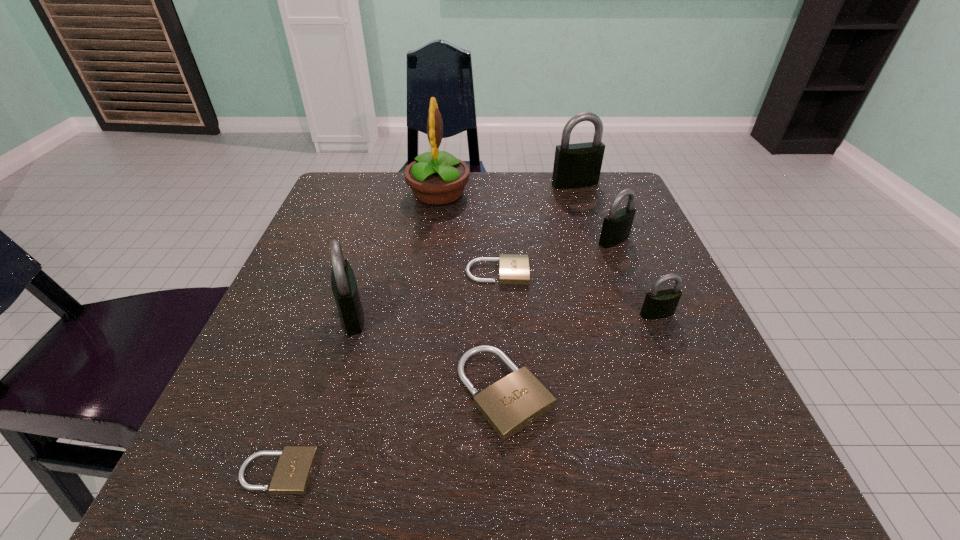
Identify the location of vacant area that lies between the farthest black padlock and the nearest object. The image size is (960, 540). (426, 328).

Find the location of a particular element. This screenshot has width=960, height=540. vacant region between the second nearest padlock and the biggest black padlock is located at coordinates (540, 288).

This screenshot has width=960, height=540. Find the location of `unoccupied position between the seventh farthest object and the third biggest black padlock`. unoccupied position between the seventh farthest object and the third biggest black padlock is located at coordinates (560, 316).

The image size is (960, 540). What are the coordinates of `empty space between the biggest black padlock and the tallest object` in the screenshot? It's located at (507, 189).

Identify which object is the fifth closest to the tallest padlock. Please provide its 2D coordinates. Your answer should be formatted as a tuple, i.e. [(x, y)], where the tuple contains the x and y coordinates of a point satisfying the conditions above.

[(509, 405)]

I want to click on the fourth closest object relative to the yellow sunflower, so click(616, 228).

The width and height of the screenshot is (960, 540). I want to click on the second closest padlock to the second smallest black padlock, so click(x=660, y=304).

Choose which padlock is the nearest neighbor to the biggest beige padlock. Please provide its 2D coordinates. Your answer should be formatted as a tuple, i.e. [(x, y)], where the tuple contains the x and y coordinates of a point satisfying the conditions above.

[(513, 269)]

Choose which black padlock is the nearest neighbor to the yellow sunflower. Please provide its 2D coordinates. Your answer should be formatted as a tuple, i.e. [(x, y)], where the tuple contains the x and y coordinates of a point satisfying the conditions above.

[(578, 165)]

Image resolution: width=960 pixels, height=540 pixels. Identify the location of black padlock object that ranks as the third closest to the third shortest object. (616, 228).